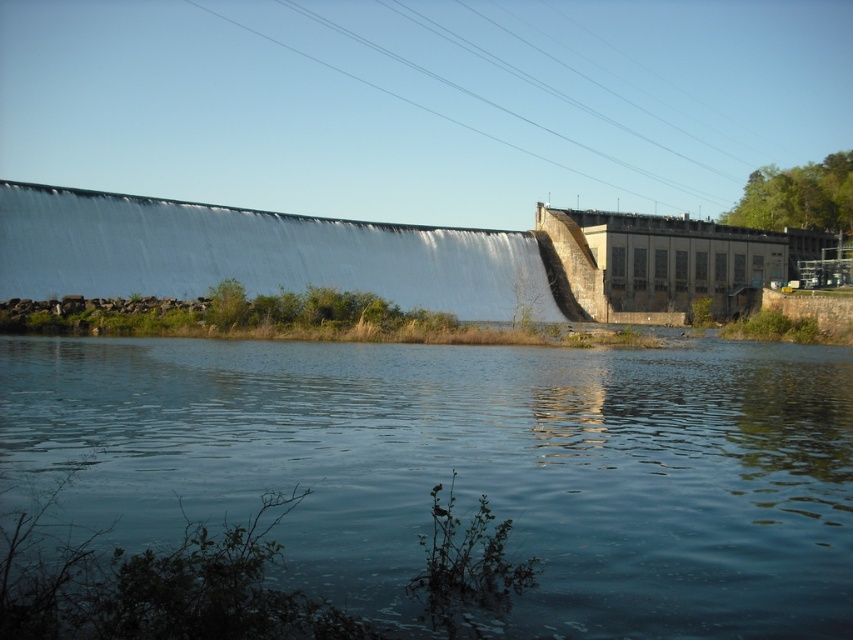
Question: Does blue water at center have a greater width compared to white smooth dam at upper center?

Choices:
 (A) no
 (B) yes

Answer: (A)

Question: Can you confirm if blue water at center is smaller than white smooth dam at upper center?

Choices:
 (A) yes
 (B) no

Answer: (A)

Question: Among these points, which one is nearest to the camera?

Choices:
 (A) (21, 232)
 (B) (352, 536)

Answer: (B)

Question: Which object appears closest to the camera in this image?

Choices:
 (A) white smooth dam at upper center
 (B) blue water at center

Answer: (B)

Question: Does blue water at center come in front of white smooth dam at upper center?

Choices:
 (A) yes
 (B) no

Answer: (A)

Question: Which of the following is the farthest from the observer?

Choices:
 (A) white smooth dam at upper center
 (B) blue water at center

Answer: (A)